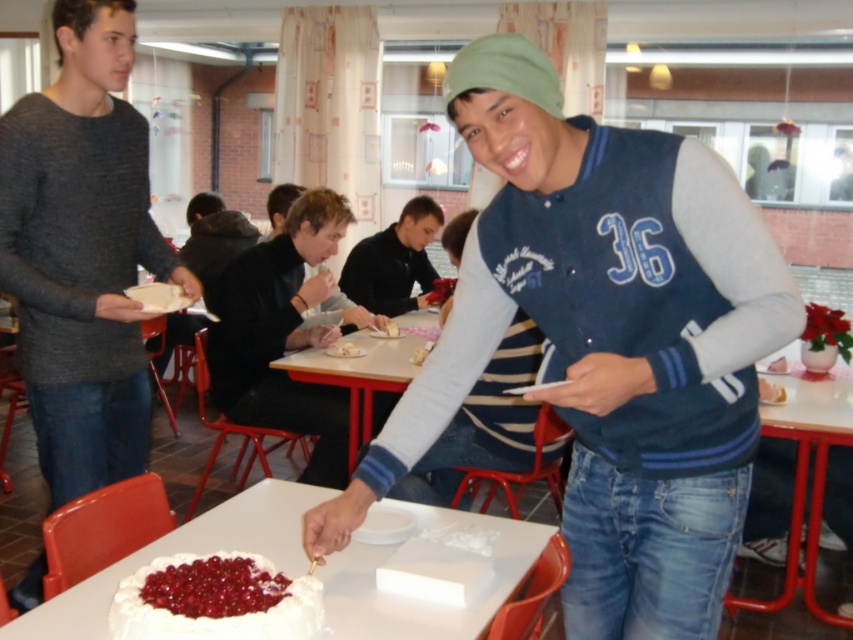
You are a photographer standing in the school cafeteria. You see the white matte table at center and the dark blue striped shirt at center. Which object is closer to the camera?

The dark blue striped shirt at center is closer to the camera because it is above the white matte table at center.

What is located at the point with coordinates [605,342] in the image?

The point with coordinates [605,342] is located on the blue jersey at center.